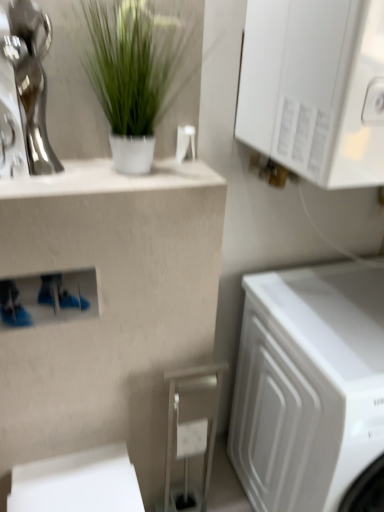
This screenshot has width=384, height=512. Describe the element at coordinates (133, 74) in the screenshot. I see `green matte plant at upper center` at that location.

Where is `white glossy counter top at upper left`? white glossy counter top at upper left is located at coordinates (110, 179).

The width and height of the screenshot is (384, 512). What do you see at coordinates (308, 385) in the screenshot? I see `white matte washing machine at lower right` at bounding box center [308, 385].

What do you see at coordinates (313, 87) in the screenshot? This screenshot has width=384, height=512. I see `white glossy cabinet at upper right` at bounding box center [313, 87].

What do you see at coordinates (24, 92) in the screenshot? I see `shiny silver statue at upper left` at bounding box center [24, 92].

In the scene shown: What is the approximate height of shiny silver statue at upper left?

shiny silver statue at upper left is 14.74 inches tall.

Where is `green matte plant at upper center`? green matte plant at upper center is located at coordinates (133, 74).

Is white glossy cabinet at upper right taller than green matte plant at upper center?

No.

Is white glossy cabinet at upper right to the left of green matte plant at upper center from the viewer's perspective?

No.

How much distance is there between white glossy cabinet at upper right and green matte plant at upper center?

white glossy cabinet at upper right and green matte plant at upper center are 31.38 centimeters apart from each other.

Is white glossy cabinet at upper right smaller than green matte plant at upper center?

Actually, white glossy cabinet at upper right might be larger than green matte plant at upper center.

Between white glossy cabinet at upper right and matte beige stool at lower center, which one has smaller width?

matte beige stool at lower center is thinner.

This screenshot has width=384, height=512. Find the location of `appliance on the left of white glossy cabinet at upper right`. appliance on the left of white glossy cabinet at upper right is located at coordinates (191, 431).

Is white glossy cabinet at upper right not close to matte beige stool at lower center?

white glossy cabinet at upper right is actually quite close to matte beige stool at lower center.

Consider the image. Is green matte plant at upper center completely or partially outside of shiny silver statue at upper left?

green matte plant at upper center lies outside shiny silver statue at upper left's area.

Which of these two, green matte plant at upper center or shiny silver statue at upper left, stands taller?

green matte plant at upper center.

Which object is positioned more to the right, green matte plant at upper center or matte beige stool at lower center?

Positioned to the right is matte beige stool at lower center.

From the image's perspective, is green matte plant at upper center over matte beige stool at lower center?

Yes, from the image's perspective, green matte plant at upper center is above matte beige stool at lower center.

Is green matte plant at upper center positioned with its back to matte beige stool at lower center?

green matte plant at upper center does not have its back to matte beige stool at lower center.

Which object is more forward, green matte plant at upper center or matte beige stool at lower center?

green matte plant at upper center.

From the image's perspective, relative to white matte washing machine at lower right, is green matte plant at upper center above or below?

green matte plant at upper center is situated higher than white matte washing machine at lower right in the image.

Who is shorter, green matte plant at upper center or white matte washing machine at lower right?

green matte plant at upper center is shorter.

Is green matte plant at upper center oriented towards white matte washing machine at lower right?

No, green matte plant at upper center does not turn towards white matte washing machine at lower right.

This screenshot has height=512, width=384. What are the coordinates of `houseplant on the left of white matte washing machine at lower right` in the screenshot? It's located at (133, 74).

Which of these two, white glossy cabinet at upper right or white matte washing machine at lower right, is smaller?

With smaller size is white glossy cabinet at upper right.

Is white glossy cabinet at upper right aimed at white matte washing machine at lower right?

No, white glossy cabinet at upper right is not turned towards white matte washing machine at lower right.

Can you see white glossy cabinet at upper right touching white matte washing machine at lower right?

No, white glossy cabinet at upper right is not in contact with white matte washing machine at lower right.

Is white glossy counter top at upper left oriented towards green matte plant at upper center?

Yes, white glossy counter top at upper left is turned towards green matte plant at upper center.

Is white glossy counter top at upper left far from green matte plant at upper center?

No, there isn't a large distance between white glossy counter top at upper left and green matte plant at upper center.

Is white glossy counter top at upper left thinner than green matte plant at upper center?

No, white glossy counter top at upper left is not thinner than green matte plant at upper center.

Is white glossy counter top at upper left not within green matte plant at upper center?

Yes, white glossy counter top at upper left is outside of green matte plant at upper center.

This screenshot has width=384, height=512. What are the coordinates of `cabinetry on the right of green matte plant at upper center` in the screenshot? It's located at (313, 87).

Where is `appliance lying below the white glossy cabinet at upper right (from the image's perspective)`? This screenshot has width=384, height=512. appliance lying below the white glossy cabinet at upper right (from the image's perspective) is located at coordinates (191, 431).

Based on their spatial positions, is matte beige stool at lower center or green matte plant at upper center further from shiny silver statue at upper left?

Based on the image, matte beige stool at lower center appears to be further to shiny silver statue at upper left.

From the picture: Which object lies further to the anchor point green matte plant at upper center, white matte washing machine at lower right or shiny silver statue at upper left?

white matte washing machine at lower right is further to green matte plant at upper center.

Considering their positions, is green matte plant at upper center positioned further to white matte washing machine at lower right than shiny silver statue at upper left?

shiny silver statue at upper left.

Based on their spatial positions, is green matte plant at upper center or white matte washing machine at lower right further from white glossy counter top at upper left?

The object further to white glossy counter top at upper left is white matte washing machine at lower right.

Looking at the image, which one is located further to green matte plant at upper center, white glossy cabinet at upper right or white matte washing machine at lower right?

white matte washing machine at lower right is positioned further to the anchor green matte plant at upper center.

Which object lies nearer to the anchor point green matte plant at upper center, matte beige stool at lower center or white glossy cabinet at upper right?

white glossy cabinet at upper right is closer to green matte plant at upper center.

Which object lies further to the anchor point matte beige stool at lower center, green matte plant at upper center or white glossy counter top at upper left?

Among the two, green matte plant at upper center is located further to matte beige stool at lower center.

Looking at the image, which one is located closer to shiny silver statue at upper left, green matte plant at upper center or white matte washing machine at lower right?

Based on the image, green matte plant at upper center appears to be nearer to shiny silver statue at upper left.

Identify the location of counter top between green matte plant at upper center and matte beige stool at lower center from top to bottom. The width and height of the screenshot is (384, 512). (110, 179).

Image resolution: width=384 pixels, height=512 pixels. In order to click on washing machine that lies between green matte plant at upper center and matte beige stool at lower center from top to bottom in this screenshot , I will do click(308, 385).

Identify the location of washing machine between white glossy counter top at upper left and matte beige stool at lower center from top to bottom. This screenshot has width=384, height=512. (308, 385).

Where is `counter top between shiny silver statue at upper left and white matte washing machine at lower right from top to bottom`? counter top between shiny silver statue at upper left and white matte washing machine at lower right from top to bottom is located at coordinates (110, 179).